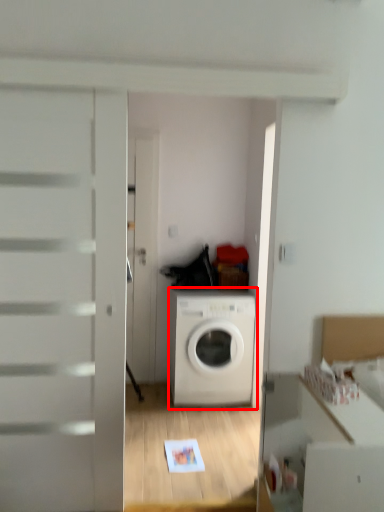
Question: Where is washing machine (annotated by the red box) located in relation to cabinetry in the image?

Choices:
 (A) right
 (B) left

Answer: (B)